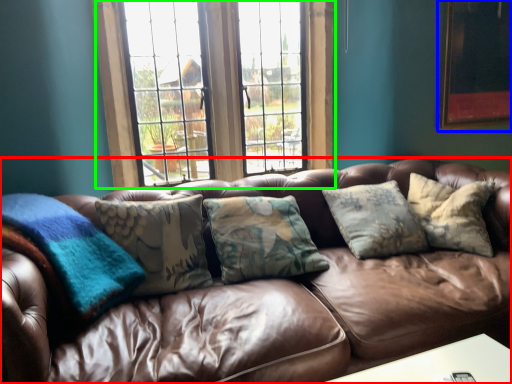
Question: Which is farther away from studio couch (highlighted by a red box)? picture frame (highlighted by a blue box) or window (highlighted by a green box)?

Choices:
 (A) picture frame
 (B) window

Answer: (A)